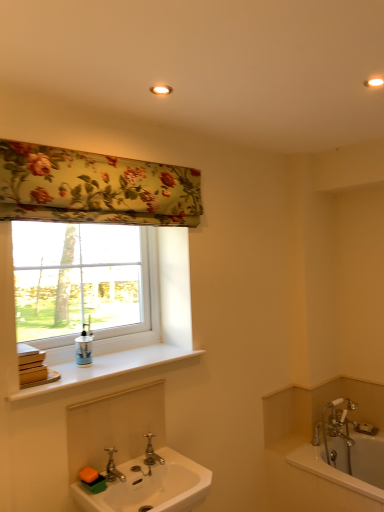
Where is `free space above floral fabric at upper left (from a real-world perspective)`? This screenshot has height=512, width=384. free space above floral fabric at upper left (from a real-world perspective) is located at coordinates (106, 152).